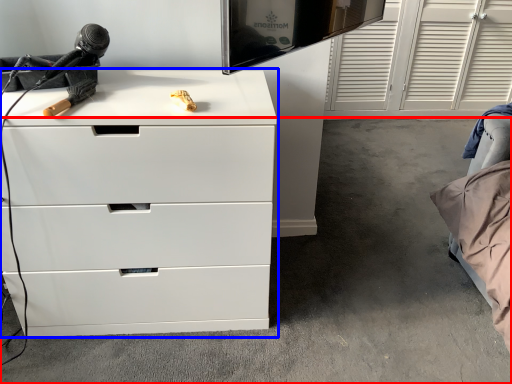
Question: Which point is further to the camera, concrete (highlighted by a red box) or chest of drawers (highlighted by a blue box)?

Choices:
 (A) concrete
 (B) chest of drawers

Answer: (A)